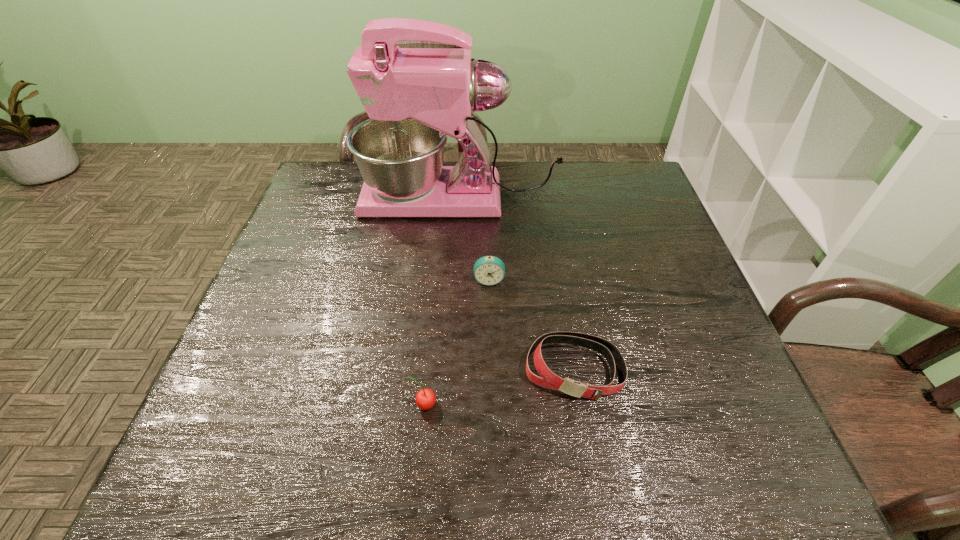
Find the location of a particular element. vacant area that lies between the cherry and the dog collar is located at coordinates (499, 387).

Where is `unoccupied position between the cherry and the tallest object`? The width and height of the screenshot is (960, 540). unoccupied position between the cherry and the tallest object is located at coordinates (443, 301).

The width and height of the screenshot is (960, 540). Identify the location of empty space that is in between the dog collar and the third nearest object. (531, 325).

Identify the location of free space that is in between the dog collar and the third nearest object. Image resolution: width=960 pixels, height=540 pixels. (531, 325).

At what (x,y) coordinates should I click in order to perform the action: click on free space between the mixer and the second farthest object. Please return your answer as a coordinate pair (x, y). This screenshot has width=960, height=540. Looking at the image, I should click on (475, 239).

Locate an element on the screen. empty space between the farthest object and the third nearest object is located at coordinates (475, 239).

Where is `vacant area between the tallest object and the shortest object`? The image size is (960, 540). vacant area between the tallest object and the shortest object is located at coordinates (517, 284).

Identify the location of empty location between the cherry and the alarm clock. The height and width of the screenshot is (540, 960). (457, 342).

This screenshot has width=960, height=540. Identify the location of vacant space that's between the tallest object and the alarm clock. (475, 239).

At what (x,y) coordinates should I click in order to perform the action: click on object that is the second closest to the farthest object. Please return your answer as a coordinate pair (x, y). Looking at the image, I should click on (548, 379).